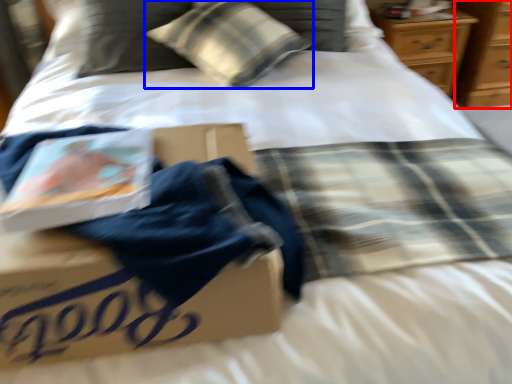
Question: Which object appears farthest to the camera in this image, dresser (highlighted by a red box) or pillow (highlighted by a blue box)?

Choices:
 (A) dresser
 (B) pillow

Answer: (A)